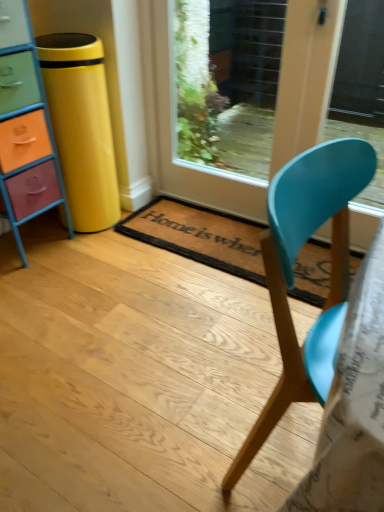
In order to face wooden glass door at center, should I rotate leftwards or rightwards?

You should rotate right by 8.039 degrees.

You are a GUI agent. You are given a task and a screenshot of the screen. Output one action in this format:
    pyautogui.click(x=<x>, y=<y>)
    Task: Click on the brown coir mat at center
    This screenshot has width=384, height=512.
    Given the screenshot: What is the action you would take?
    pyautogui.click(x=199, y=236)

Is brown coir mat at center oriented towards matte blue chair at center?

No.

How distant is brown coir mat at center from matte blue chair at center?

brown coir mat at center is 73.54 centimeters from matte blue chair at center.

Is brown coir mat at center closer to camera compared to matte blue chair at center?

No.

Find the location of a particular element. The height and width of the screenshot is (512, 384). chair below the brown coir mat at center (from the image's perspective) is located at coordinates (293, 274).

Considering the sizes of objects multicolored painted wood chest of drawers at left and wooden glass door at center in the image provided, who is smaller, multicolored painted wood chest of drawers at left or wooden glass door at center?

wooden glass door at center.

From the image's perspective, is multicolored painted wood chest of drawers at left located above or below wooden glass door at center?

multicolored painted wood chest of drawers at left is situated lower than wooden glass door at center in the image.

Can you see multicolored painted wood chest of drawers at left touching wooden glass door at center?

They are not placed beside each other.

Does brown coir mat at center have a larger size compared to wooden glass door at center?

No, brown coir mat at center is not bigger than wooden glass door at center.

Is brown coir mat at center aimed at wooden glass door at center?

No, brown coir mat at center is not facing towards wooden glass door at center.

Is the position of brown coir mat at center more distant than that of wooden glass door at center?

Yes, the depth of brown coir mat at center is greater than that of wooden glass door at center.

From a real-world perspective, who is located higher, brown coir mat at center or wooden glass door at center?

In real-world perspective, wooden glass door at center is above.

Where is `door above the brown coir mat at center (from a real-world perspective)`? This screenshot has height=512, width=384. door above the brown coir mat at center (from a real-world perspective) is located at coordinates (265, 93).

Which point is more distant from viewer, [288,9] or [304,278]?

Point [304,278]

From a real-world perspective, which is physically above, wooden glass door at center or brown coir mat at center?

From a 3D spatial view, wooden glass door at center is above.

Are multicolored painted wood chest of drawers at left and matte blue chair at center beside each other?

No, multicolored painted wood chest of drawers at left is not with matte blue chair at center.

Is multicolored painted wood chest of drawers at left to the left or to the right of matte blue chair at center in the image?

Based on their positions, multicolored painted wood chest of drawers at left is located to the left of matte blue chair at center.

Between multicolored painted wood chest of drawers at left and matte blue chair at center, which one has more height?

multicolored painted wood chest of drawers at left.

Considering the sizes of objects multicolored painted wood chest of drawers at left and brown coir mat at center in the image provided, who is wider, multicolored painted wood chest of drawers at left or brown coir mat at center?

brown coir mat at center.

From the image's perspective, would you say multicolored painted wood chest of drawers at left is shown under brown coir mat at center?

No.

Which is more to the left, multicolored painted wood chest of drawers at left or brown coir mat at center?

multicolored painted wood chest of drawers at left is more to the left.

Which of these two, multicolored painted wood chest of drawers at left or brown coir mat at center, stands taller?

multicolored painted wood chest of drawers at left is taller.

Is point (284, 91) farther from viewer compared to point (18, 119)?

Yes.

I want to click on door above the multicolored painted wood chest of drawers at left (from the image's perspective), so click(x=265, y=93).

What's the angular difference between wooden glass door at center and multicolored painted wood chest of drawers at left's facing directions?

They differ by 89.6 degrees in their facing directions.

Considering the sizes of objects wooden glass door at center and multicolored painted wood chest of drawers at left in the image provided, who is shorter, wooden glass door at center or multicolored painted wood chest of drawers at left?

wooden glass door at center is shorter.

The width and height of the screenshot is (384, 512). I want to click on mat on the left of matte blue chair at center, so click(x=199, y=236).

This screenshot has height=512, width=384. What are the coordinates of `door behind the multicolored painted wood chest of drawers at left` in the screenshot? It's located at (265, 93).

Looking at this image, considering their positions, is matte blue chair at center positioned further to wooden glass door at center than multicolored painted wood chest of drawers at left?

matte blue chair at center lies further to wooden glass door at center than the other object.

From the image, which object appears to be farther from wooden glass door at center, brown coir mat at center or multicolored painted wood chest of drawers at left?

Based on the image, multicolored painted wood chest of drawers at left appears to be further to wooden glass door at center.

Which object lies further to the anchor point wooden glass door at center, multicolored painted wood chest of drawers at left or brown coir mat at center?

multicolored painted wood chest of drawers at left.

When comparing their distances from matte blue chair at center, does wooden glass door at center or brown coir mat at center seem further?

Among the two, wooden glass door at center is located further to matte blue chair at center.

From the image, which object appears to be nearer to brown coir mat at center, multicolored painted wood chest of drawers at left or matte blue chair at center?

multicolored painted wood chest of drawers at left is positioned closer to the anchor brown coir mat at center.

Based on their spatial positions, is wooden glass door at center or multicolored painted wood chest of drawers at left closer to matte blue chair at center?

multicolored painted wood chest of drawers at left lies closer to matte blue chair at center than the other object.

Based on their spatial positions, is brown coir mat at center or matte blue chair at center closer to multicolored painted wood chest of drawers at left?

brown coir mat at center.

Estimate the real-world distances between objects in this image. Which object is further from brown coir mat at center, multicolored painted wood chest of drawers at left or wooden glass door at center?

multicolored painted wood chest of drawers at left lies further to brown coir mat at center than the other object.

You are a GUI agent. You are given a task and a screenshot of the screen. Output one action in this format:
    pyautogui.click(x=<x>, y=<y>)
    Task: Click on the door between matte blue chair at center and brown coir mat at center along the z-axis
    Image resolution: width=384 pixels, height=512 pixels.
    Given the screenshot: What is the action you would take?
    pyautogui.click(x=265, y=93)

Where is `mat between multicolored painted wood chest of drawers at left and wooden glass door at center from left to right`? The image size is (384, 512). mat between multicolored painted wood chest of drawers at left and wooden glass door at center from left to right is located at coordinates (199, 236).

Find the location of a particular element. door located between multicolored painted wood chest of drawers at left and matte blue chair at center in the left-right direction is located at coordinates (265, 93).

Where is `chest of drawers between matte blue chair at center and brown coir mat at center in the front-back direction`? Image resolution: width=384 pixels, height=512 pixels. chest of drawers between matte blue chair at center and brown coir mat at center in the front-back direction is located at coordinates (25, 128).